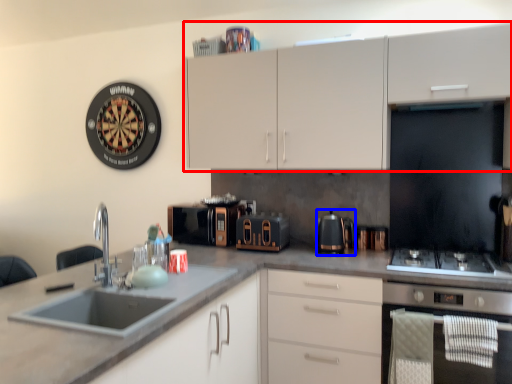
Question: Which point is further to the camera, cabinetry (highlighted by a red box) or kitchen appliance (highlighted by a blue box)?

Choices:
 (A) cabinetry
 (B) kitchen appliance

Answer: (B)